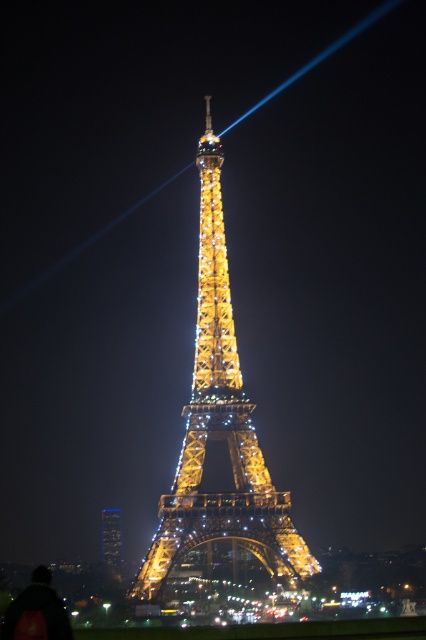
From the picture: You are a photographer standing at the base of the Eiffel Tower and want to capture both the point at coordinates point (192, 412) and point (115, 525) in your photo. Which point will appear larger in your photo?

Point (192, 412) is closer to the camera than point (115, 525), so it will appear larger in the photo.